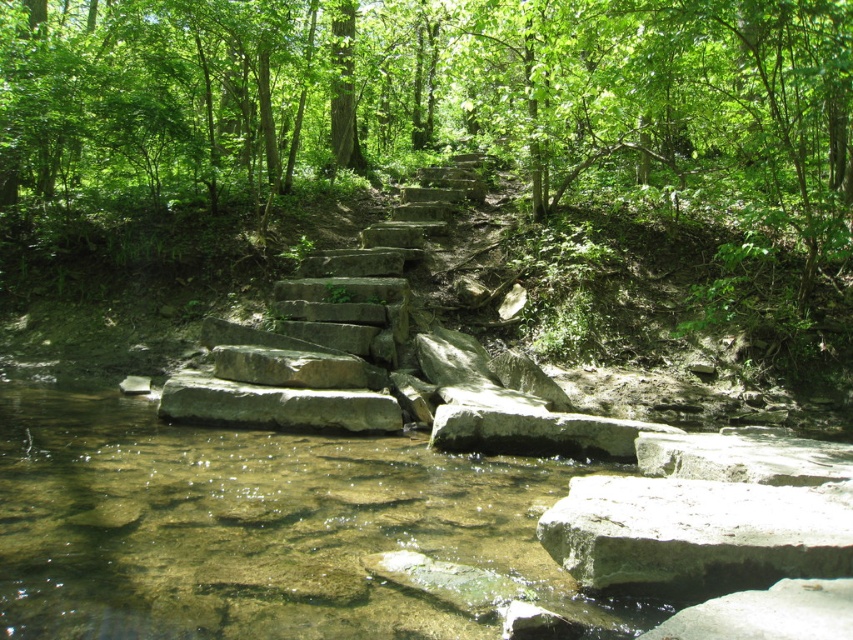
Does clear stone water at center have a lesser width compared to gray stone boulder at center?

Correct, clear stone water at center's width is less than gray stone boulder at center's.

Does clear stone water at center have a greater height compared to gray stone boulder at center?

No.

What are the coordinates of `clear stone water at center` in the screenshot? It's located at pos(254,528).

Where is `clear stone water at center`? This screenshot has height=640, width=853. clear stone water at center is located at coordinates (254, 528).

Does clear stone water at center have a greater height compared to gray rough rock at lower center?

Incorrect, clear stone water at center's height is not larger of gray rough rock at lower center's.

Who is positioned more to the right, clear stone water at center or gray rough rock at lower center?

gray rough rock at lower center

Between point (607, 634) and point (695, 532), which one is positioned behind?

The point (695, 532) is more distant.

Where is `clear stone water at center`? This screenshot has height=640, width=853. clear stone water at center is located at coordinates (254, 528).

Which is more to the right, gray rough rock at lower center or gray stone boulder at center?

Positioned to the right is gray rough rock at lower center.

Can you confirm if gray rough rock at lower center is smaller than gray stone boulder at center?

Correct, gray rough rock at lower center occupies less space than gray stone boulder at center.

Image resolution: width=853 pixels, height=640 pixels. I want to click on gray rough rock at lower center, so click(695, 534).

Locate an element on the screen. gray rough rock at lower center is located at coordinates (695, 534).